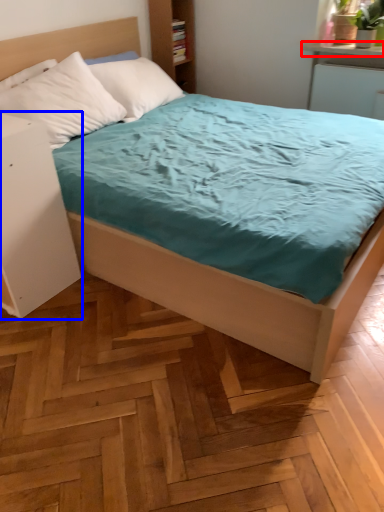
Question: Which of the following is the farthest to the observer, window sill (highlighted by a red box) or nightstand (highlighted by a blue box)?

Choices:
 (A) window sill
 (B) nightstand

Answer: (A)